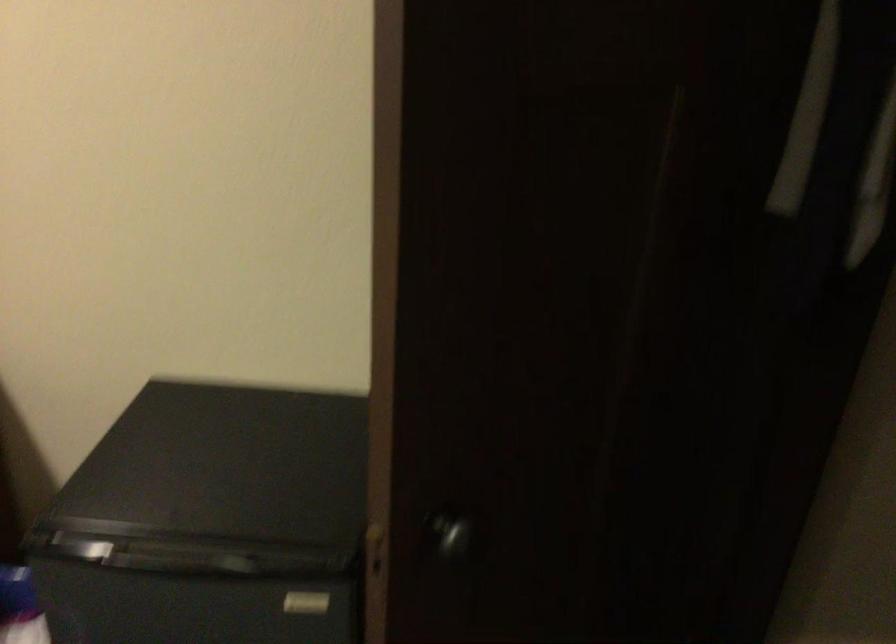
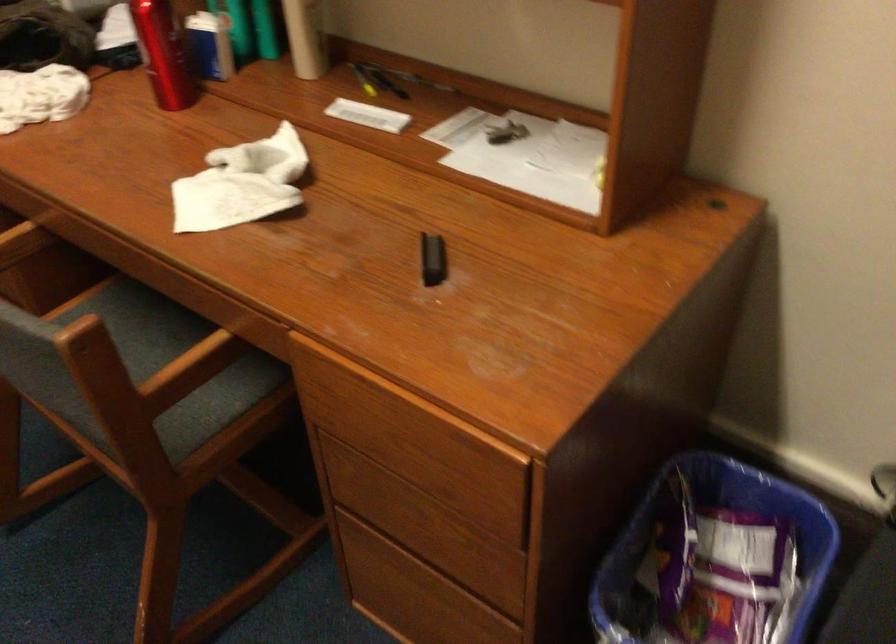
The images are taken continuously from a first-person perspective. In which direction is your viewpoint rotating?

The rotation direction of the camera is left-down.